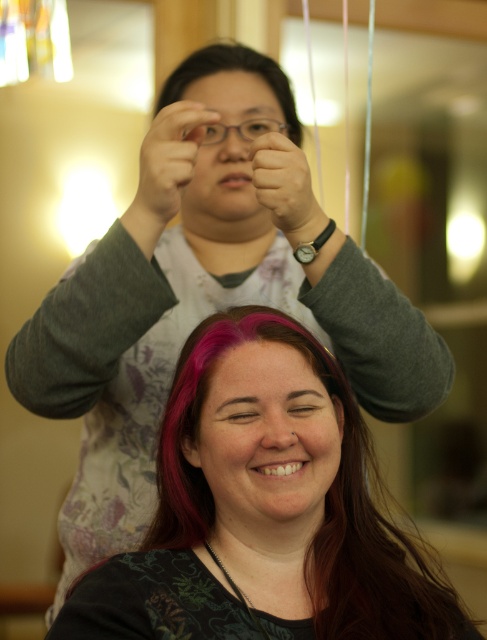
Question: Which point is closer to the camera?

Choices:
 (A) matte black eye at upper center
 (B) matte gray hand at center
 (C) brown matte eye at center

Answer: (C)

Question: Is matte black eye at center to the left of matte black glasses at upper center from the viewer's perspective?

Choices:
 (A) no
 (B) yes

Answer: (A)

Question: Estimate the real-world distances between objects in this image. Which object is closer to the matte black glasses at upper center?

Choices:
 (A) matte black eye at center
 (B) brown matte eye at center
 (C) matte gray hand at upper center

Answer: (C)

Question: Which object is farther from the camera taking this photo?

Choices:
 (A) shiny pink hair at center
 (B) purple hair at upper center

Answer: (B)

Question: Does matte gray hand at upper center come behind matte black eye at upper center?

Choices:
 (A) yes
 (B) no

Answer: (B)

Question: Is matte gray hand at upper center further to camera compared to brown matte eye at center?

Choices:
 (A) yes
 (B) no

Answer: (A)